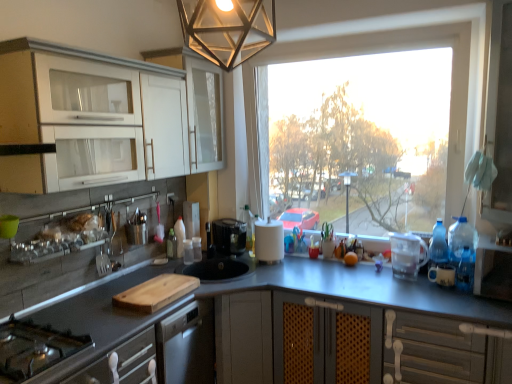
Where is `blank space to the left of blue plastic cup at right, which is counted as the second appliance, starting from the left`? The width and height of the screenshot is (512, 384). blank space to the left of blue plastic cup at right, which is counted as the second appliance, starting from the left is located at coordinates (407, 289).